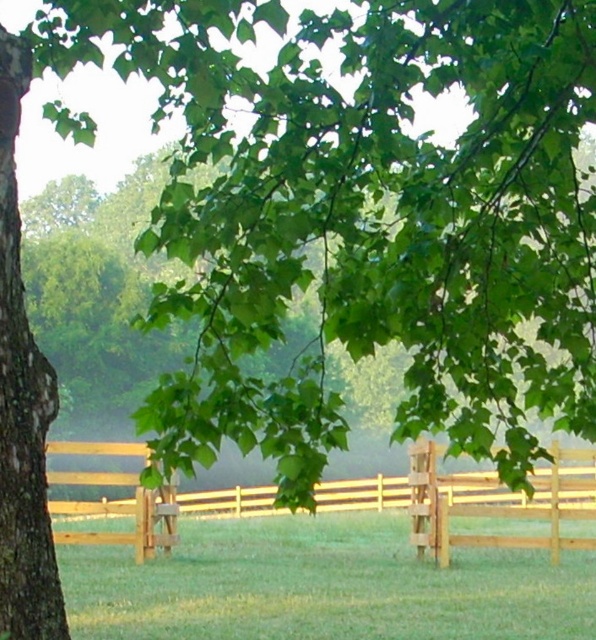
You are a painter setting up an easel to paint the fences in the scene. You need to know which fence is wider to choose the right canvas size. Based on the scene, can you tell me if the light brown wooden fence at center is wider than the brown wooden fence at lower right?

The light brown wooden fence at center might be wider than brown wooden fence at lower right according to the description.

You are a painter standing at the edge of the scene and want to paint both the light brown wooden fence at center and the brown wooden fence at lower right. If your painting canvas is 1.5 meters wide, can you fit both fences on the canvas at the same time?

The light brown wooden fence at center and brown wooden fence at lower right are 7.06 meters apart. Since the canvas is only 1.5 meters wide, the distance between them is too large to fit both on the canvas simultaneously.

You are standing in a rural area and see the light brown wooden fence at center and the brown wooden fence at lower right. Which fence is closer to you?

The light brown wooden fence at center is closer to you because it is positioned under the brown wooden fence at lower right, indicating it is in front.